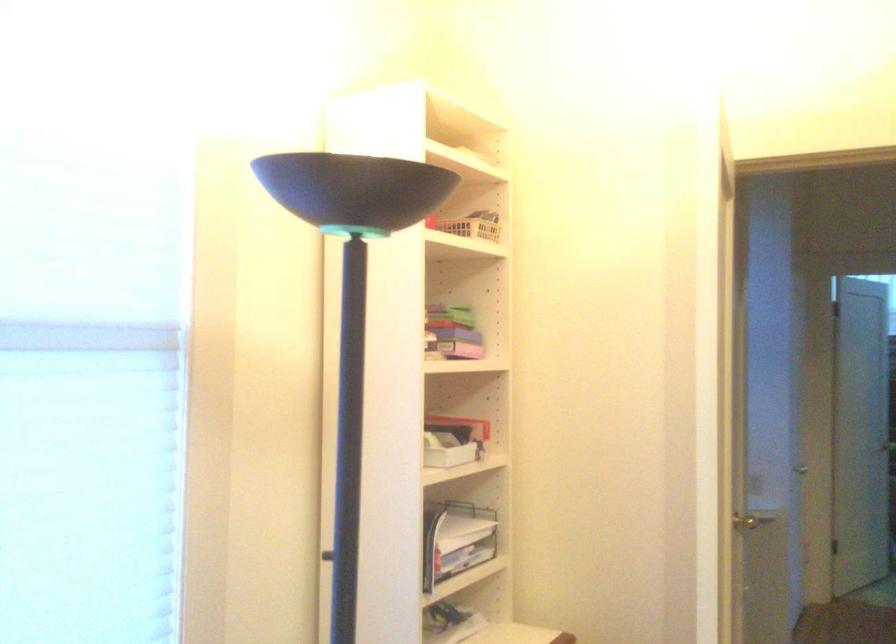
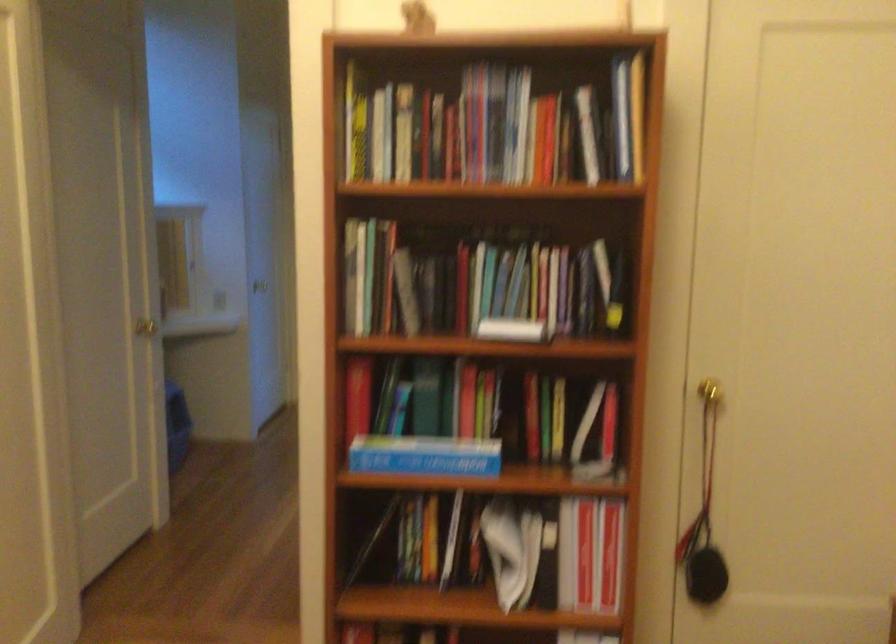
The images are taken continuously from a first-person perspective. In which direction are you moving?

The cameraman moved toward right, backward.